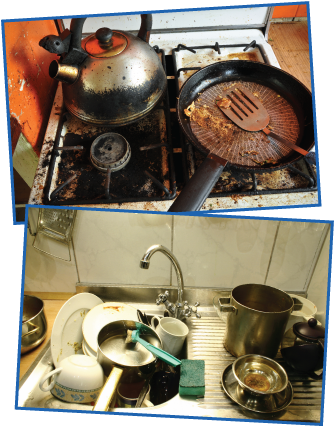
Locate an element on the screen. sponge on side of sink is located at coordinates (195, 372).